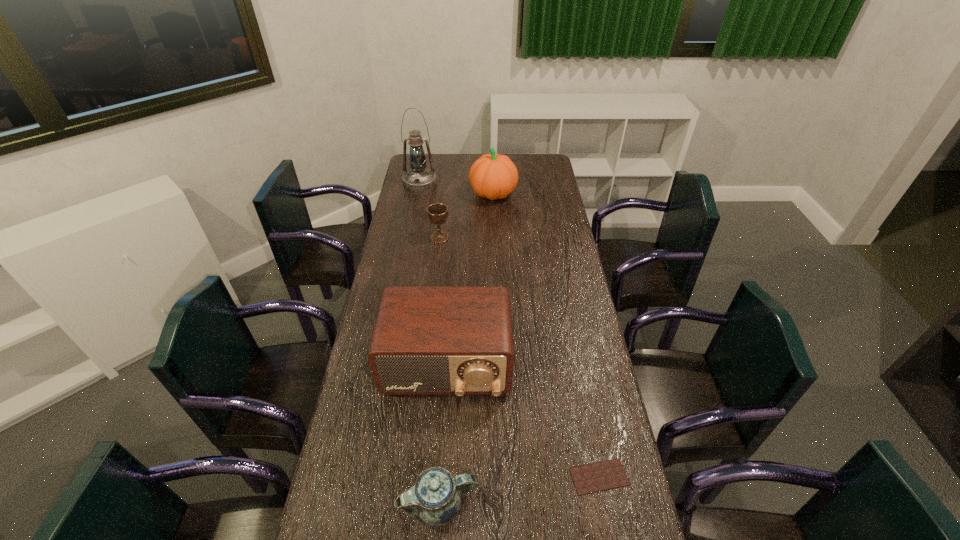
You are a GUI agent. You are given a task and a screenshot of the screen. Output one action in this format:
    pyautogui.click(x=<x>, y=<y>)
    Task: Click on the vacant space located 0.160m on the right of the third farthest object
    This screenshot has height=540, width=960.
    Given the screenshot: What is the action you would take?
    pyautogui.click(x=486, y=237)

At what (x,y) coordinates should I click in order to perform the action: click on blank space located 0.170m from the spout of the chinaware. Please return your answer as a coordinate pair (x, y). Looking at the image, I should click on (543, 504).

This screenshot has width=960, height=540. I want to click on vacant space located 0.330m on the back of the rightmost object, so pos(577,362).

At what (x,y) coordinates should I click in order to perform the action: click on object that is at the far edge. Please return your answer as a coordinate pair (x, y). Image resolution: width=960 pixels, height=540 pixels. Looking at the image, I should click on (418, 178).

Where is `oil lamp positioned at the left edge`? This screenshot has height=540, width=960. oil lamp positioned at the left edge is located at coordinates (418, 178).

Locate an element on the screen. This screenshot has width=960, height=540. radio receiver that is at the left edge is located at coordinates (458, 341).

The height and width of the screenshot is (540, 960). In order to click on object located in the right edge section of the desktop in this screenshot , I will do `click(595, 477)`.

Locate an element on the screen. object present at the far left corner is located at coordinates click(418, 178).

Identify the location of vacant space at the far edge of the desktop. (472, 153).

The image size is (960, 540). I want to click on free space at the left edge of the desktop, so (387, 280).